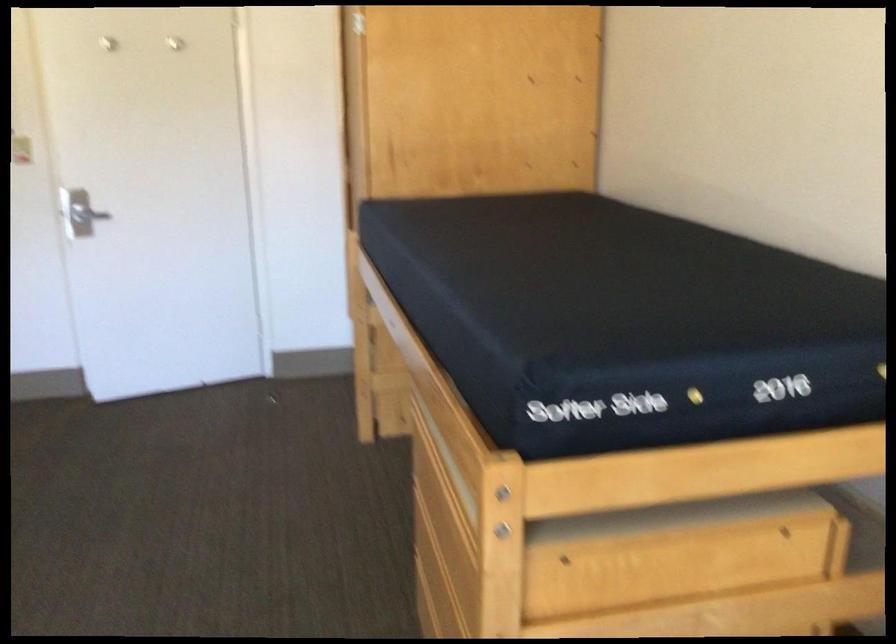
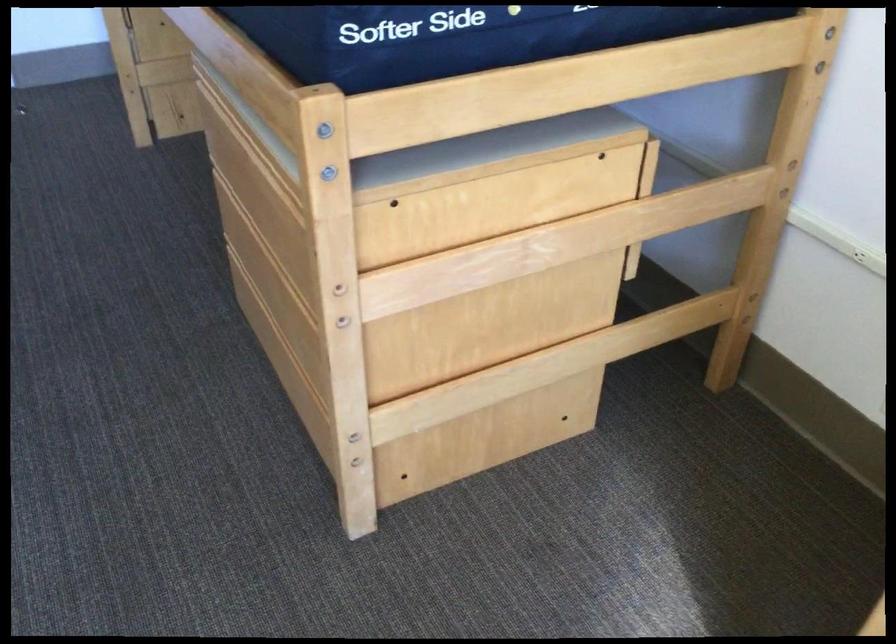
Question: The images are taken continuously from a first-person perspective. In which direction is your viewpoint rotating?

Choices:
 (A) Left
 (B) Right
 (C) Up
 (D) Down

Answer: (D)